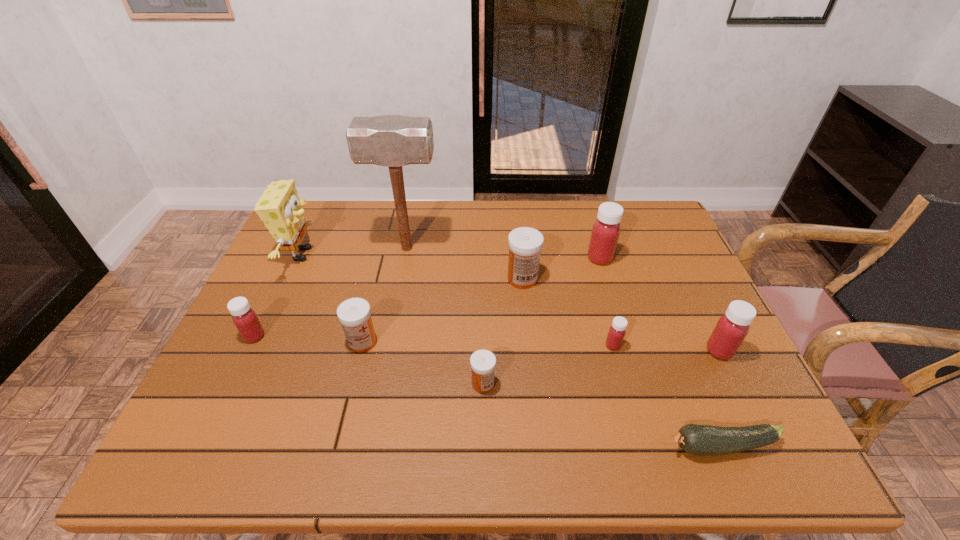
Locate an element on the screen. Image resolution: width=960 pixels, height=540 pixels. the leftmost white medicine is located at coordinates (354, 314).

I want to click on the third biggest red medicine, so click(x=245, y=319).

The image size is (960, 540). I want to click on the leftmost red medicine, so click(245, 319).

Image resolution: width=960 pixels, height=540 pixels. I want to click on the smallest red medicine, so click(616, 333).

Locate an element on the screen. The height and width of the screenshot is (540, 960). the second white medicine from left to right is located at coordinates (483, 362).

Image resolution: width=960 pixels, height=540 pixels. In order to click on the ninth farthest object in this screenshot , I will do `click(483, 362)`.

Locate an element on the screen. the shortest object is located at coordinates (697, 439).

Identify the location of the nearest object. (697, 439).

The height and width of the screenshot is (540, 960). Identify the location of vacant space located 0.080m on the striking face of the mallet. (466, 248).

The image size is (960, 540). In order to click on free space located 0.170m on the face of the sponge in this screenshot , I will do `click(374, 254)`.